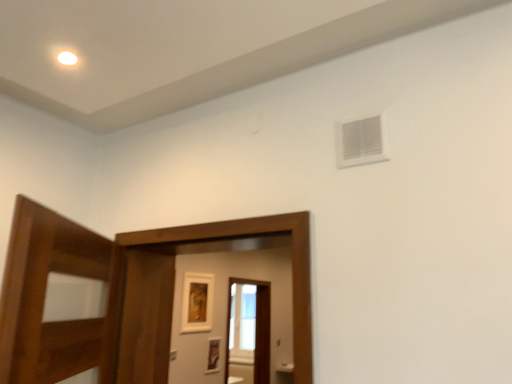
Measure the distance between matte gold picture frame at center, arranged as the 1th picture frame when ordered from the bottom, and camera.

The depth of matte gold picture frame at center, arranged as the 1th picture frame when ordered from the bottom, is 4.49 meters.

Describe the element at coordinates (174, 286) in the screenshot. This screenshot has width=512, height=384. I see `brown wooden screen door at center, the second screen door from the bottom` at that location.

Where is `matte gold picture frame at center, the 1th picture frame from the top`? The height and width of the screenshot is (384, 512). matte gold picture frame at center, the 1th picture frame from the top is located at coordinates (197, 302).

Locate an element on the screen. transparent glass screen door at center, which is the 1th screen door from back to front is located at coordinates (253, 326).

Can you confirm if matte gold picture frame at center, arranged as the 1th picture frame when ordered from the bottom, is positioned to the left of matte gold picture frame at center, which is the second picture frame in bottom-to-top order?

In fact, matte gold picture frame at center, arranged as the 1th picture frame when ordered from the bottom, is to the right of matte gold picture frame at center, which is the second picture frame in bottom-to-top order.

Can you confirm if matte gold picture frame at center, arranged as the 1th picture frame when ordered from the bottom, is taller than matte gold picture frame at center, which is the second picture frame in bottom-to-top order?

No.

Could you tell me if matte gold picture frame at center, positioned as the second picture frame in top-to-bottom order, is facing matte gold picture frame at center, the 1th picture frame from the top?

No, matte gold picture frame at center, positioned as the second picture frame in top-to-bottom order, is not facing towards matte gold picture frame at center, the 1th picture frame from the top.

Considering the relative sizes of matte gold picture frame at center, arranged as the 1th picture frame when ordered from the bottom, and matte gold picture frame at center, the 1th picture frame from the top, in the image provided, is matte gold picture frame at center, arranged as the 1th picture frame when ordered from the bottom, wider than matte gold picture frame at center, the 1th picture frame from the top,?

Incorrect, the width of matte gold picture frame at center, arranged as the 1th picture frame when ordered from the bottom, does not surpass that of matte gold picture frame at center, the 1th picture frame from the top.

Is white plastic vent at upper right inside matte gold picture frame at center, arranged as the 1th picture frame when ordered from the bottom?

No, white plastic vent at upper right is not surrounded by matte gold picture frame at center, arranged as the 1th picture frame when ordered from the bottom.

Does point (215, 339) come in front of point (371, 124)?

No, it is behind (371, 124).

Does matte gold picture frame at center, positioned as the second picture frame in top-to-bottom order, have a larger size compared to white plastic vent at upper right?

Yes.

Is matte gold picture frame at center, positioned as the second picture frame in top-to-bottom order, wider than white plastic vent at upper right?

Yes.

Considering the positions of objects transparent glass screen door at center, arranged as the 2th screen door when viewed from the front, and matte gold picture frame at center, positioned as the second picture frame in top-to-bottom order, in the image provided, who is more to the left, transparent glass screen door at center, arranged as the 2th screen door when viewed from the front, or matte gold picture frame at center, positioned as the second picture frame in top-to-bottom order,?

matte gold picture frame at center, positioned as the second picture frame in top-to-bottom order.

Consider the image. How different are the orientations of transparent glass screen door at center, arranged as the 2th screen door when viewed from the front, and matte gold picture frame at center, positioned as the second picture frame in top-to-bottom order, in degrees?

They differ by 0.0169 degrees in their facing directions.

Is transparent glass screen door at center, the first screen door when ordered from bottom to top, positioned with its back to matte gold picture frame at center, positioned as the second picture frame in top-to-bottom order?

No, transparent glass screen door at center, the first screen door when ordered from bottom to top, is not facing the opposite direction of matte gold picture frame at center, positioned as the second picture frame in top-to-bottom order.

Is matte gold picture frame at center, positioned as the second picture frame in top-to-bottom order, inside transparent glass screen door at center, which is the 1th screen door from back to front?

No, matte gold picture frame at center, positioned as the second picture frame in top-to-bottom order, is not surrounded by transparent glass screen door at center, which is the 1th screen door from back to front.

Can you confirm if matte gold picture frame at center, which is the second picture frame in bottom-to-top order, is positioned to the right of matte gold picture frame at center, arranged as the 1th picture frame when ordered from the bottom?

No.

From a real-world perspective, which is physically below, matte gold picture frame at center, the 1th picture frame from the top, or matte gold picture frame at center, positioned as the second picture frame in top-to-bottom order?

In real-world perspective, matte gold picture frame at center, positioned as the second picture frame in top-to-bottom order, is lower.

Is point (185, 302) in front of point (210, 361)?

Yes, it is.

Can you confirm if matte gold picture frame at center, which is the second picture frame in bottom-to-top order, is smaller than matte gold picture frame at center, arranged as the 1th picture frame when ordered from the bottom?

No, matte gold picture frame at center, which is the second picture frame in bottom-to-top order, is not smaller than matte gold picture frame at center, arranged as the 1th picture frame when ordered from the bottom.

What's the angular difference between matte gold picture frame at center, arranged as the 1th picture frame when ordered from the bottom, and brown wooden screen door at center, placed as the first screen door when sorted from top to bottom,'s facing directions?

The angle between the facing direction of matte gold picture frame at center, arranged as the 1th picture frame when ordered from the bottom, and the facing direction of brown wooden screen door at center, placed as the first screen door when sorted from top to bottom, is 88.5 degrees.

Which is correct: matte gold picture frame at center, arranged as the 1th picture frame when ordered from the bottom, is inside brown wooden screen door at center, the second screen door from the bottom, or outside of it?

matte gold picture frame at center, arranged as the 1th picture frame when ordered from the bottom, lies outside brown wooden screen door at center, the second screen door from the bottom.

From a real-world perspective, is matte gold picture frame at center, arranged as the 1th picture frame when ordered from the bottom, above or below brown wooden screen door at center, the second screen door from the bottom?

From a real-world perspective, matte gold picture frame at center, arranged as the 1th picture frame when ordered from the bottom, is physically below brown wooden screen door at center, the second screen door from the bottom.

Which object is wider, matte gold picture frame at center, positioned as the second picture frame in top-to-bottom order, or brown wooden screen door at center, the second screen door from the bottom?

brown wooden screen door at center, the second screen door from the bottom, is wider.

Which object is positioned more to the left, brown wooden screen door at center, placed as the first screen door when sorted from top to bottom, or matte gold picture frame at center, arranged as the 1th picture frame when ordered from the bottom?

Positioned to the left is matte gold picture frame at center, arranged as the 1th picture frame when ordered from the bottom.

In terms of height, does brown wooden screen door at center, arranged as the second screen door when viewed from the back, look taller or shorter compared to matte gold picture frame at center, arranged as the 1th picture frame when ordered from the bottom?

In the image, brown wooden screen door at center, arranged as the second screen door when viewed from the back, appears to be taller than matte gold picture frame at center, arranged as the 1th picture frame when ordered from the bottom.

Does point (166, 264) appear closer or farther from the camera than point (218, 337)?

Point (166, 264).

In the scene shown: Can you confirm if brown wooden screen door at center, the second screen door from the bottom, is bigger than matte gold picture frame at center, arranged as the 1th picture frame when ordered from the bottom?

Indeed, brown wooden screen door at center, the second screen door from the bottom, has a larger size compared to matte gold picture frame at center, arranged as the 1th picture frame when ordered from the bottom.

Are white plastic vent at upper right and brown wooden screen door at center, arranged as the second screen door when viewed from the back, far apart?

That's not correct — white plastic vent at upper right is a little close to brown wooden screen door at center, arranged as the second screen door when viewed from the back.

Between white plastic vent at upper right and brown wooden screen door at center, arranged as the second screen door when viewed from the back, which one has smaller width?

Thinner between the two is white plastic vent at upper right.

Is white plastic vent at upper right looking in the opposite direction of brown wooden screen door at center, arranged as the second screen door when viewed from the back?

No, white plastic vent at upper right's orientation is not away from brown wooden screen door at center, arranged as the second screen door when viewed from the back.

I want to click on picture frame behind the matte gold picture frame at center, the 1th picture frame from the top, so click(213, 355).

You are a GUI agent. You are given a task and a screenshot of the screen. Output one action in this format:
    pyautogui.click(x=<x>, y=<y>)
    Task: Click on the 2nd picture frame located beneath the white plastic vent at upper right (from a real-world perspective)
    
    Given the screenshot: What is the action you would take?
    pyautogui.click(x=213, y=355)

Which object lies further to the anchor point brown wooden screen door at center, the second screen door from the bottom, transparent glass screen door at center, the second screen door from the top, or matte gold picture frame at center, positioned as the second picture frame in top-to-bottom order?

Based on the image, matte gold picture frame at center, positioned as the second picture frame in top-to-bottom order, appears to be further to brown wooden screen door at center, the second screen door from the bottom.

Looking at this image, from the image, which object appears to be nearer to transparent glass screen door at center, the first screen door when ordered from bottom to top, matte gold picture frame at center, arranged as the 1th picture frame when ordered from the bottom, or white plastic vent at upper right?

matte gold picture frame at center, arranged as the 1th picture frame when ordered from the bottom, lies closer to transparent glass screen door at center, the first screen door when ordered from bottom to top, than the other object.

Based on their spatial positions, is matte gold picture frame at center, positioned as the second picture frame in top-to-bottom order, or white plastic vent at upper right further from matte gold picture frame at center, the 1th picture frame from the top?

white plastic vent at upper right is further to matte gold picture frame at center, the 1th picture frame from the top.

Which object lies nearer to the anchor point matte gold picture frame at center, arranged as the 1th picture frame when ordered from the bottom, brown wooden screen door at center, acting as the first screen door starting from the front, or white plastic vent at upper right?

The object closer to matte gold picture frame at center, arranged as the 1th picture frame when ordered from the bottom, is brown wooden screen door at center, acting as the first screen door starting from the front.

Estimate the real-world distances between objects in this image. Which object is further from matte gold picture frame at center, which is the second picture frame in bottom-to-top order, transparent glass screen door at center, the second screen door from the top, or matte gold picture frame at center, positioned as the second picture frame in top-to-bottom order?

transparent glass screen door at center, the second screen door from the top, is further to matte gold picture frame at center, which is the second picture frame in bottom-to-top order.

In the scene shown: From the image, which object appears to be nearer to brown wooden screen door at center, arranged as the second screen door when viewed from the back, matte gold picture frame at center, arranged as the 1th picture frame when ordered from the bottom, or white plastic vent at upper right?

white plastic vent at upper right lies closer to brown wooden screen door at center, arranged as the second screen door when viewed from the back, than the other object.

Looking at the image, which one is located further to matte gold picture frame at center, which is the second picture frame in bottom-to-top order, white plastic vent at upper right or transparent glass screen door at center, arranged as the 2th screen door when viewed from the front?

Among the two, white plastic vent at upper right is located further to matte gold picture frame at center, which is the second picture frame in bottom-to-top order.

Based on their spatial positions, is brown wooden screen door at center, arranged as the second screen door when viewed from the back, or transparent glass screen door at center, which is the 1th screen door from back to front, further from white plastic vent at upper right?

transparent glass screen door at center, which is the 1th screen door from back to front, lies further to white plastic vent at upper right than the other object.

Where is `screen door between matte gold picture frame at center, which is the second picture frame in bottom-to-top order, and matte gold picture frame at center, arranged as the 1th picture frame when ordered from the bottom, from top to bottom`? The width and height of the screenshot is (512, 384). screen door between matte gold picture frame at center, which is the second picture frame in bottom-to-top order, and matte gold picture frame at center, arranged as the 1th picture frame when ordered from the bottom, from top to bottom is located at coordinates (253, 326).

Find the location of a particular element. air conditioning between brown wooden screen door at center, acting as the first screen door starting from the front, and matte gold picture frame at center, positioned as the second picture frame in top-to-bottom order, from front to back is located at coordinates (360, 142).

This screenshot has width=512, height=384. What are the coordinates of `picture frame between brown wooden screen door at center, acting as the first screen door starting from the front, and matte gold picture frame at center, positioned as the second picture frame in top-to-bottom order, from front to back` in the screenshot? It's located at pos(197,302).

Identify the location of picture frame between white plastic vent at upper right and matte gold picture frame at center, arranged as the 1th picture frame when ordered from the bottom, from front to back. This screenshot has height=384, width=512. (197, 302).